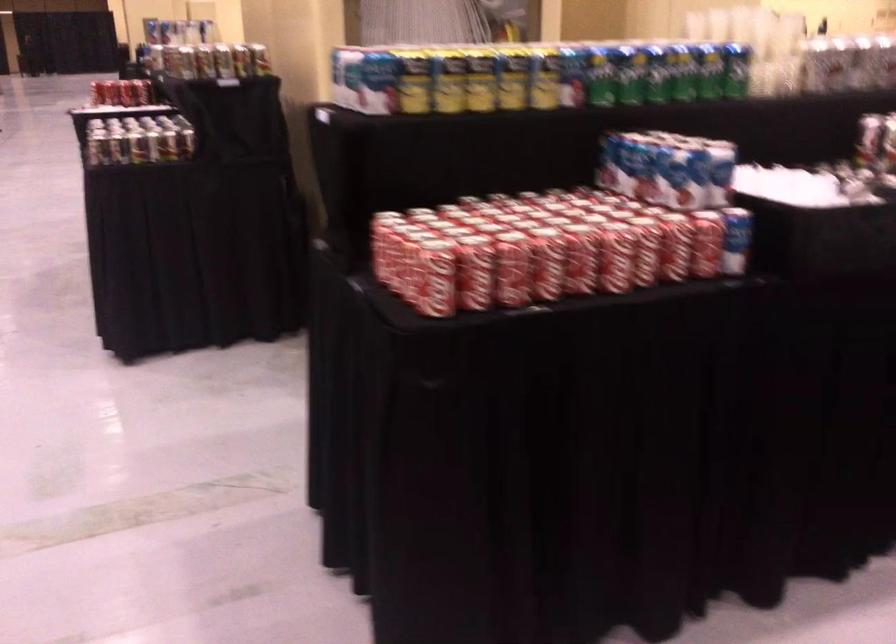
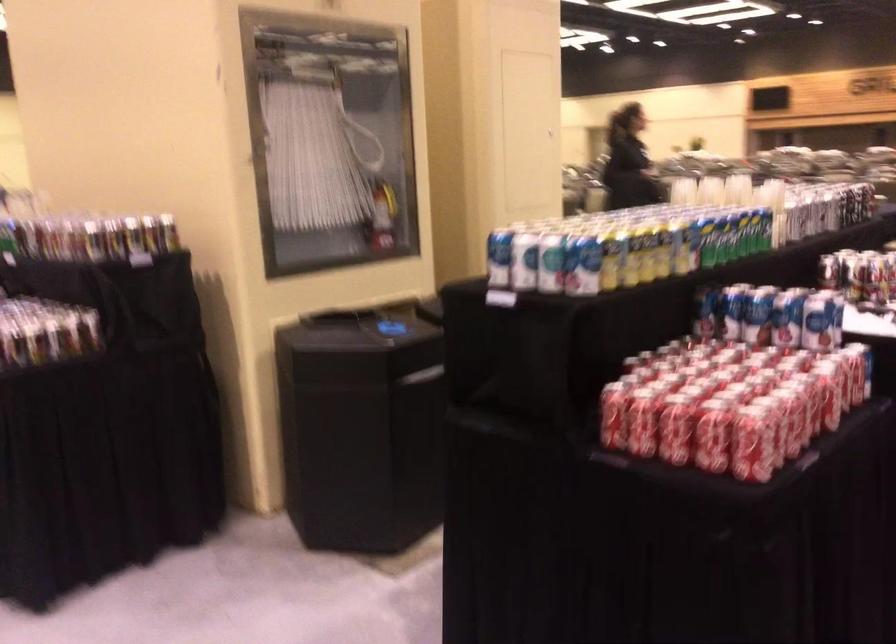
Where in the second image is the point corresponding to (384,261) from the first image?

(674, 430)